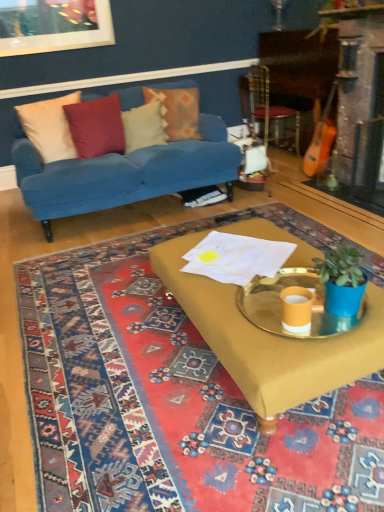
The image size is (384, 512). In order to click on velvet blue couch at upper left in this screenshot , I will do click(x=122, y=173).

The width and height of the screenshot is (384, 512). What do you see at coordinates (170, 402) in the screenshot? I see `yellow fabric mat at center` at bounding box center [170, 402].

Describe the element at coordinates (49, 127) in the screenshot. I see `beige fabric pillow at left, positioned as the fourth pillow in right-to-left order` at that location.

You are a GUI agent. You are given a task and a screenshot of the screen. Output one action in this format:
    pyautogui.click(x=<x>, y=<y>)
    Task: Click on the velvety red pillow at upper left, the 2th pillow from the left
    
    Given the screenshot: What is the action you would take?
    pyautogui.click(x=96, y=126)

Image resolution: width=384 pixels, height=512 pixels. What are the coordinates of `velvet blue couch at upper left` in the screenshot? It's located at (122, 173).

Considering the relative positions of metallic gold tray at center and floral fabric pillow at upper center, the fourth pillow in the left-to-right sequence, in the image provided, is metallic gold tray at center behind floral fabric pillow at upper center, the fourth pillow in the left-to-right sequence,?

That is False.

Is floral fabric pillow at upper center, positioned as the first pillow in right-to-left order, at the back of metallic gold tray at center?

No, metallic gold tray at center is not facing away from floral fabric pillow at upper center, positioned as the first pillow in right-to-left order.

Is metallic gold tray at center touching floral fabric pillow at upper center, positioned as the first pillow in right-to-left order?

They are not placed beside each other.

Between metallic gold tray at center and floral fabric pillow at upper center, positioned as the first pillow in right-to-left order, which one has larger width?

With larger width is metallic gold tray at center.

Could you measure the distance between floral fabric pillow at upper center, positioned as the first pillow in right-to-left order, and velvet blue couch at upper left?

19.94 inches.

Is floral fabric pillow at upper center, the fourth pillow in the left-to-right sequence, smaller than velvet blue couch at upper left?

Correct, floral fabric pillow at upper center, the fourth pillow in the left-to-right sequence, occupies less space than velvet blue couch at upper left.

Between floral fabric pillow at upper center, the fourth pillow in the left-to-right sequence, and velvet blue couch at upper left, which one is positioned behind?

floral fabric pillow at upper center, the fourth pillow in the left-to-right sequence, is more distant.

Considering the relative sizes of metallic gold tray at center and mustard fabric coffee table at center in the image provided, is metallic gold tray at center bigger than mustard fabric coffee table at center?

Actually, metallic gold tray at center might be smaller than mustard fabric coffee table at center.

Which of these two, metallic gold tray at center or mustard fabric coffee table at center, is thinner?

metallic gold tray at center.

From a real-world perspective, is metallic gold tray at center located higher than mustard fabric coffee table at center?

Yes, from a real-world perspective, metallic gold tray at center is over mustard fabric coffee table at center

Is point (75, 135) in front of point (383, 307)?

No, (75, 135) is further to viewer.

From a real-world perspective, who is located higher, velvety red pillow at upper left, the 2th pillow from the left, or mustard fabric coffee table at center?

velvety red pillow at upper left, the 2th pillow from the left.

In the image, is velvety red pillow at upper left, arranged as the third pillow when viewed from the right, positioned in front of or behind mustard fabric coffee table at center?

Visually, velvety red pillow at upper left, arranged as the third pillow when viewed from the right, is located behind mustard fabric coffee table at center.

Can you tell me how much velvet blue couch at upper left and blue matte plant pot at right differ in facing direction?

The facing directions of velvet blue couch at upper left and blue matte plant pot at right are 92.8 degrees apart.

Looking at the image, does velvet blue couch at upper left seem bigger or smaller compared to blue matte plant pot at right?

In the image, velvet blue couch at upper left appears to be larger than blue matte plant pot at right.

In the image, is velvet blue couch at upper left positioned in front of or behind blue matte plant pot at right?

In the image, velvet blue couch at upper left appears behind blue matte plant pot at right.

Find the location of `houseplant beneath the velvet blue couch at upper left (from a real-world perspective)`. houseplant beneath the velvet blue couch at upper left (from a real-world perspective) is located at coordinates (342, 280).

In the image, is white soft pillow at upper center, marked as the second pillow in a right-to-left arrangement, positioned in front of or behind metallic gold tray at center?

white soft pillow at upper center, marked as the second pillow in a right-to-left arrangement, is behind metallic gold tray at center.

Based on the photo, considering the relative positions of white soft pillow at upper center, the third pillow viewed from the left, and metallic gold tray at center in the image provided, is white soft pillow at upper center, the third pillow viewed from the left, to the right of metallic gold tray at center from the viewer's perspective?

No.

Are white soft pillow at upper center, the third pillow viewed from the left, and metallic gold tray at center far apart?

Yes.

Is mustard fabric coffee table at center far away from floral fabric pillow at upper center, the fourth pillow in the left-to-right sequence?

That's right, there is a large distance between mustard fabric coffee table at center and floral fabric pillow at upper center, the fourth pillow in the left-to-right sequence.

Is mustard fabric coffee table at center outside of floral fabric pillow at upper center, positioned as the first pillow in right-to-left order?

mustard fabric coffee table at center lies outside floral fabric pillow at upper center, positioned as the first pillow in right-to-left order,'s area.

Could you tell me if mustard fabric coffee table at center is turned towards floral fabric pillow at upper center, the fourth pillow in the left-to-right sequence?

No, mustard fabric coffee table at center is not aimed at floral fabric pillow at upper center, the fourth pillow in the left-to-right sequence.

From a real-world perspective, which object stands above the other?

In real-world perspective, floral fabric pillow at upper center, the fourth pillow in the left-to-right sequence, is above.

This screenshot has width=384, height=512. What are the coordinates of `round table in front of the floral fabric pillow at upper center, positioned as the first pillow in right-to-left order` in the screenshot? It's located at (281, 304).

You are a GUI agent. You are given a task and a screenshot of the screen. Output one action in this format:
    pyautogui.click(x=<x>, y=<y>)
    Task: Click on the studio couch that appears below the floral fabric pillow at upper center, positioned as the first pillow in right-to-left order (from a real-world perspective)
    The image size is (384, 512).
    Given the screenshot: What is the action you would take?
    122,173

From the image, which object appears to be nearer to metallic gold armchair at upper right, velvety red pillow at upper left, the 2th pillow from the left, or blue matte plant pot at right?

velvety red pillow at upper left, the 2th pillow from the left, is closer to metallic gold armchair at upper right.

From the picture: When comparing their distances from white soft pillow at upper center, the third pillow viewed from the left, does velvet blue couch at upper left or mustard fabric coffee table at center seem further?

mustard fabric coffee table at center lies further to white soft pillow at upper center, the third pillow viewed from the left, than the other object.

Which object lies nearer to the anchor point metallic gold armchair at upper right, floral fabric pillow at upper center, positioned as the first pillow in right-to-left order, or metallic gold tray at center?

floral fabric pillow at upper center, positioned as the first pillow in right-to-left order, is positioned closer to the anchor metallic gold armchair at upper right.

Looking at the image, which one is located further to mustard fabric coffee table at center, white soft pillow at upper center, marked as the second pillow in a right-to-left arrangement, or beige fabric pillow at left, positioned as the fourth pillow in right-to-left order?

white soft pillow at upper center, marked as the second pillow in a right-to-left arrangement.

Estimate the real-world distances between objects in this image. Which object is further from velvety red pillow at upper left, arranged as the third pillow when viewed from the right, mustard fabric coffee table at center or metallic gold armchair at upper right?

mustard fabric coffee table at center.

Which object lies further to the anchor point floral fabric pillow at upper center, the fourth pillow in the left-to-right sequence, white soft pillow at upper center, the third pillow viewed from the left, or beige fabric pillow at left, the 1th pillow viewed from the left?

beige fabric pillow at left, the 1th pillow viewed from the left, lies further to floral fabric pillow at upper center, the fourth pillow in the left-to-right sequence, than the other object.

Which object lies further to the anchor point metallic gold tray at center, beige fabric pillow at left, positioned as the fourth pillow in right-to-left order, or yellow fabric mat at center?

beige fabric pillow at left, positioned as the fourth pillow in right-to-left order, lies further to metallic gold tray at center than the other object.

Considering their positions, is mustard fabric coffee table at center positioned closer to metallic gold armchair at upper right than blue matte plant pot at right?

Based on the image, mustard fabric coffee table at center appears to be nearer to metallic gold armchair at upper right.

In order to click on round table between yellow fabric mat at center and velvet blue couch at upper left in the front-back direction in this screenshot , I will do `click(281, 304)`.

Find the location of `houseplant between mustard fabric coffee table at center and floral fabric pillow at upper center, positioned as the first pillow in right-to-left order, along the z-axis`. houseplant between mustard fabric coffee table at center and floral fabric pillow at upper center, positioned as the first pillow in right-to-left order, along the z-axis is located at coordinates (342, 280).

This screenshot has height=512, width=384. In order to click on round table positioned between mustard fabric coffee table at center and metallic gold armchair at upper right from near to far in this screenshot , I will do `click(281, 304)`.

Find the location of `studio couch positioned between metallic gold tray at center and floral fabric pillow at upper center, the fourth pillow in the left-to-right sequence, from near to far`. studio couch positioned between metallic gold tray at center and floral fabric pillow at upper center, the fourth pillow in the left-to-right sequence, from near to far is located at coordinates (122, 173).